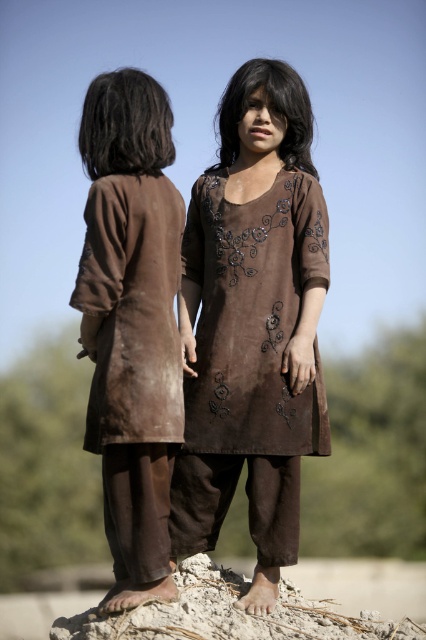
Who is more forward, (267, 244) or (103, 481)?

Positioned in front is point (103, 481).

Does brown suede kurta at center come in front of brown suede dress at left?

No, brown suede kurta at center is behind brown suede dress at left.

Between point (253, 70) and point (132, 116), which one is positioned in front?

Point (132, 116) is more forward.

The width and height of the screenshot is (426, 640). Identify the location of brown suede kurta at center. (253, 324).

Which is in front, point (294, 488) or point (258, 422)?

Point (258, 422) is in front.

The image size is (426, 640). Describe the element at coordinates (253, 324) in the screenshot. I see `brown suede kurta at center` at that location.

Describe the element at coordinates (253, 324) in the screenshot. I see `brown suede kurta at center` at that location.

Locate an element on the screen. brown suede kurta at center is located at coordinates (253, 324).

Describe the element at coordinates (132, 323) in the screenshot. I see `brown suede dress at left` at that location.

Who is more distant from viewer, (x=81, y=292) or (x=207, y=401)?

Point (x=207, y=401)

Locate an element on the screen. The height and width of the screenshot is (640, 426). brown suede dress at left is located at coordinates (132, 323).

Identify the location of brown suede dress at left. The height and width of the screenshot is (640, 426). (132, 323).